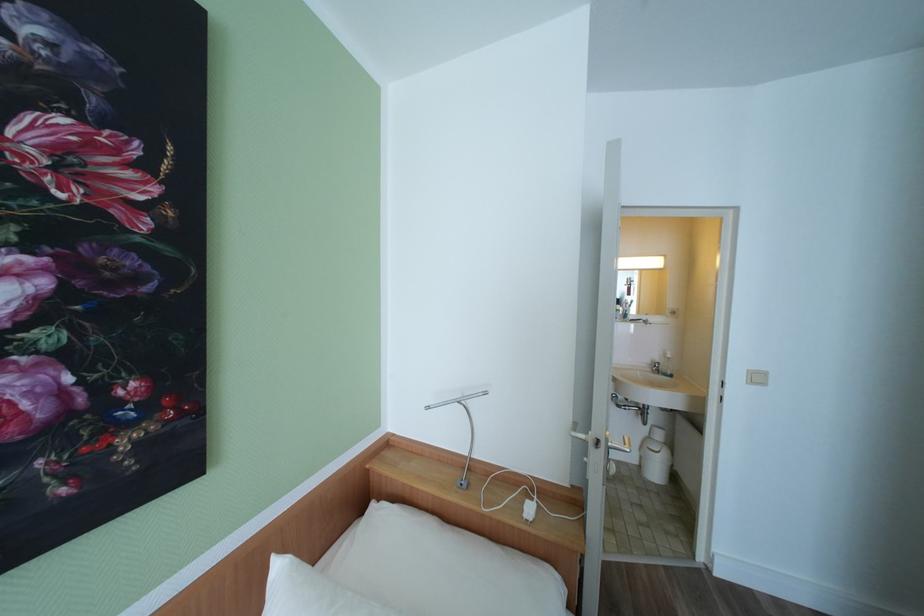
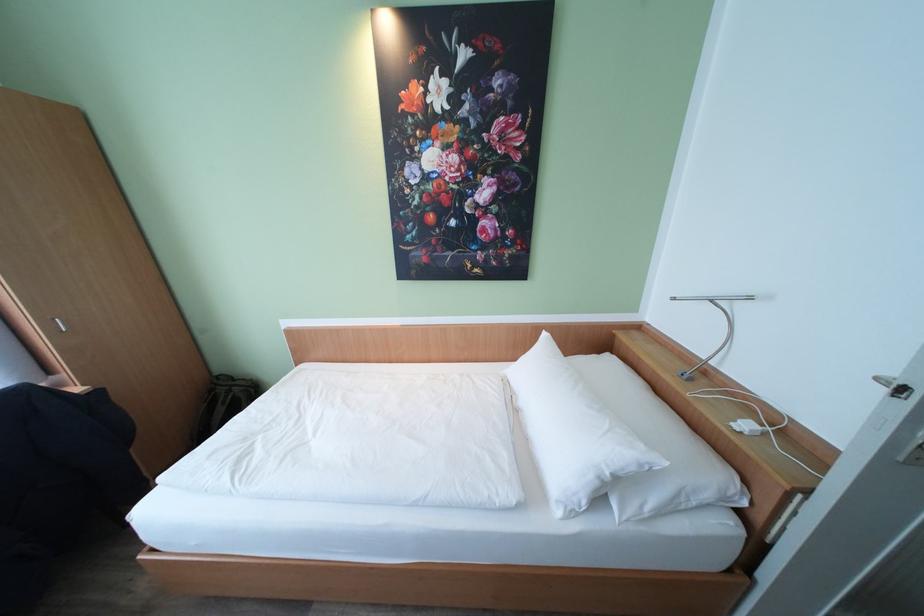
Find the pixel in the second image that matches the point at 468,485 in the first image.

(689, 377)